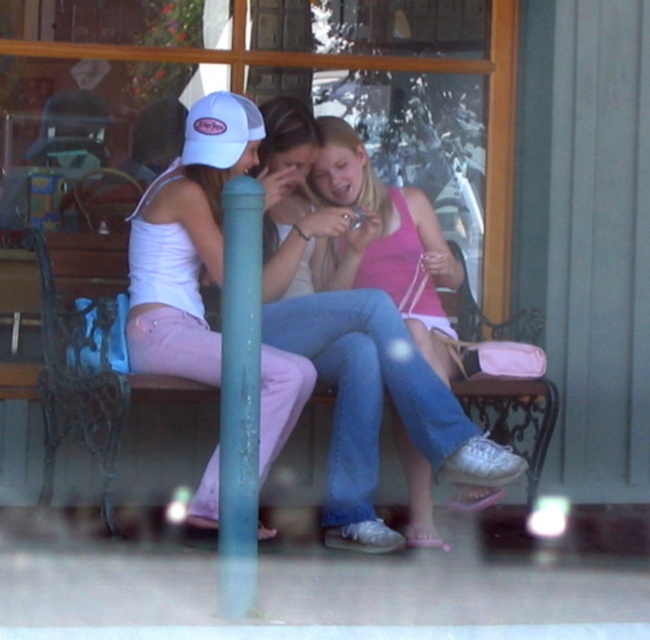
You are a photographer trying to capture a candid shot of the group on the bench. The pink fabric tank top at center and the white matte tank top at left are part of your focus. Which of these two items is positioned higher in the frame?

The pink fabric tank top at center is much taller than the white matte tank top at left, so it is positioned higher in the frame.

You are a photographer trying to capture a group photo of the three people on the bench. The pink fabric tank top at center and the white matte tank top at left are two of them. Since you want to ensure both are clearly visible, which one should you focus on first considering their sizes?

The pink fabric tank top at center is bigger than the white matte tank top at left, so you should focus on the pink fabric tank top at center first to ensure it is in clear focus before adjusting for the smaller one.

You are a photographer trying to capture a candid shot of the group. Since you want to ensure the pink fabric tank top at center and the white mesh baseball cap at upper left are both clearly visible, which one should you focus on first to ensure depth of field?

The pink fabric tank top at center is in front of the white mesh baseball cap at upper left, so you should focus on the pink fabric tank top at center first to ensure both are in focus.